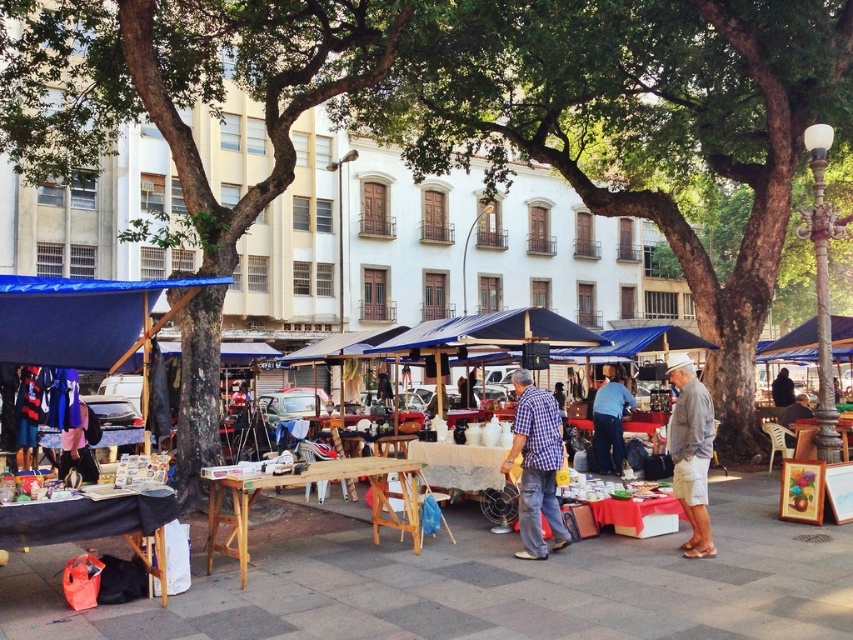
You are a vendor at the outdoor market and want to display the checkered fabric shirt at center on the smooth wooden table at center. Can the shirt fit entirely on the table without hanging over the edges?

The checkered fabric shirt at center has a width less than the smooth wooden table at center, so the shirt can fit entirely on the table without hanging over the edges.

You are at the outdoor market and want to buy the gray cotton shirt at center. To get there, you need to walk around the green leafy tree at left. Which direction should you go to avoid the tree?

Since the green leafy tree at left is to the left of the gray cotton shirt at center, you should go to the right to avoid the tree and reach the gray cotton shirt at center.

You are a customer at the market and want to place a large basket on the blue fabric bag at center and the smooth wooden table at center. Which surface can accommodate the basket without overcrowding?

The smooth wooden table at center can accommodate the basket without overcrowding because it occupies more space than the blue fabric bag at center.